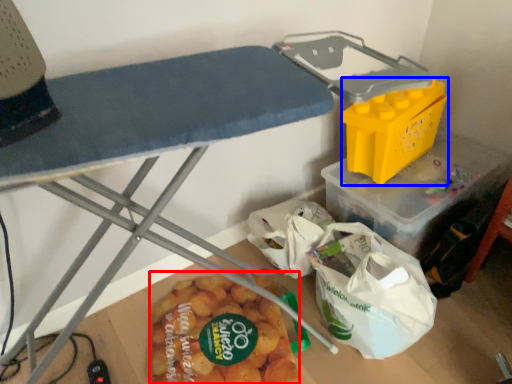
Question: Which object is closer to the camera taking this photo, food (highlighted by a red box) or box (highlighted by a blue box)?

Choices:
 (A) food
 (B) box

Answer: (A)